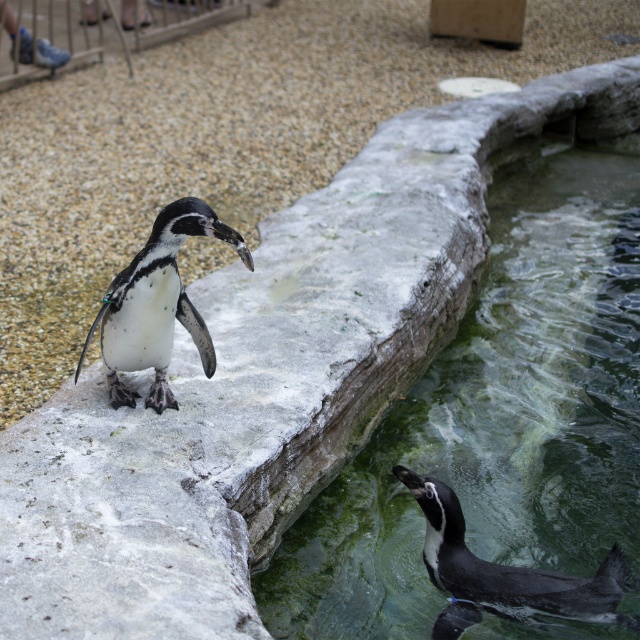
Question: Which object appears farthest from the camera in this image?

Choices:
 (A) black glossy penguin at lower right
 (B) white matte penguin at center

Answer: (A)

Question: Can you confirm if white matte penguin at center is smaller than black glossy penguin at lower right?

Choices:
 (A) yes
 (B) no

Answer: (B)

Question: Among these points, which one is nearest to the camera?

Choices:
 (A) (100, 323)
 (B) (616, 596)

Answer: (B)

Question: Does white matte penguin at center have a larger size compared to black glossy penguin at lower right?

Choices:
 (A) no
 (B) yes

Answer: (B)

Question: Where is green mossy rock at lower center located in relation to black glossy penguin at lower right in the image?

Choices:
 (A) left
 (B) right

Answer: (B)

Question: Which point appears closest to the camera in this image?

Choices:
 (A) (360, 497)
 (B) (172, 248)
 (C) (476, 564)

Answer: (C)